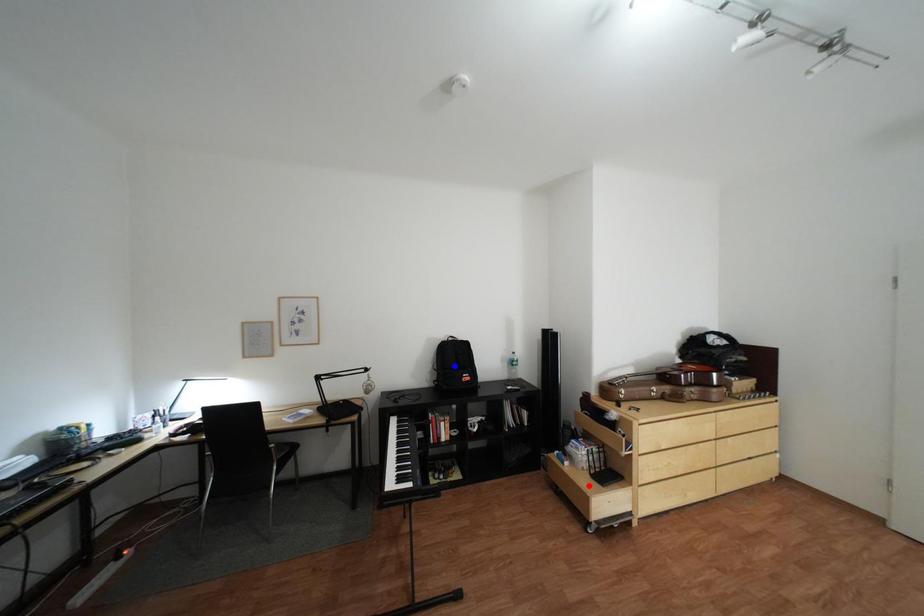
Question: In the image, two points are highlighted. Which point is nearer to the camera? Reply with the corresponding letter.

Choices:
 (A) blue point
 (B) red point

Answer: (B)